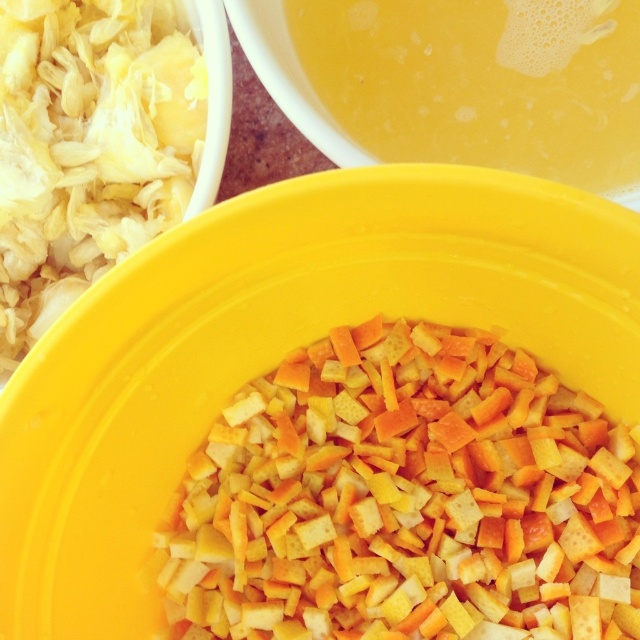
Looking at this image, where is the yellow crumbly at center located in the image?

The yellow crumbly at center is located at point [403,499] in the image.

You are preparing a salad and need to determine the order of layers. The white shredded cabbage at upper left and the yellow liquid at upper center are both part of the recipe. Based on their positions in the image, which should be placed first in the bowl?

The white shredded cabbage at upper left should be placed first because it is positioned under the yellow liquid at upper center in the image, indicating it is lower in the layering order.

You are standing 30 inches away from the point at coordinates point (x=596, y=620). Can you reach the bowls in the image?

The distance of point (x=596, y=620) from the viewer is 31.03 inches, so you are currently 30 inches away from the point. This means you are slightly closer than the point, so you can reach the bowls in the image.